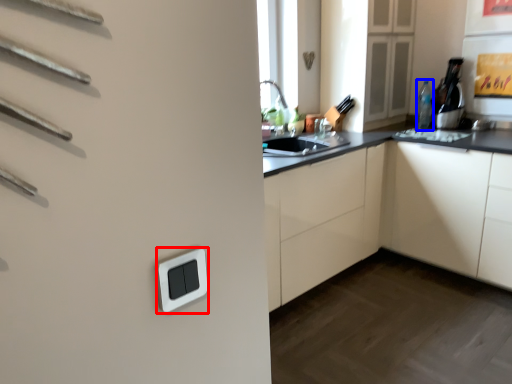
Question: Which object appears closest to the camera in this image, light switch (highlighted by a red box) or bottle (highlighted by a blue box)?

Choices:
 (A) light switch
 (B) bottle

Answer: (A)